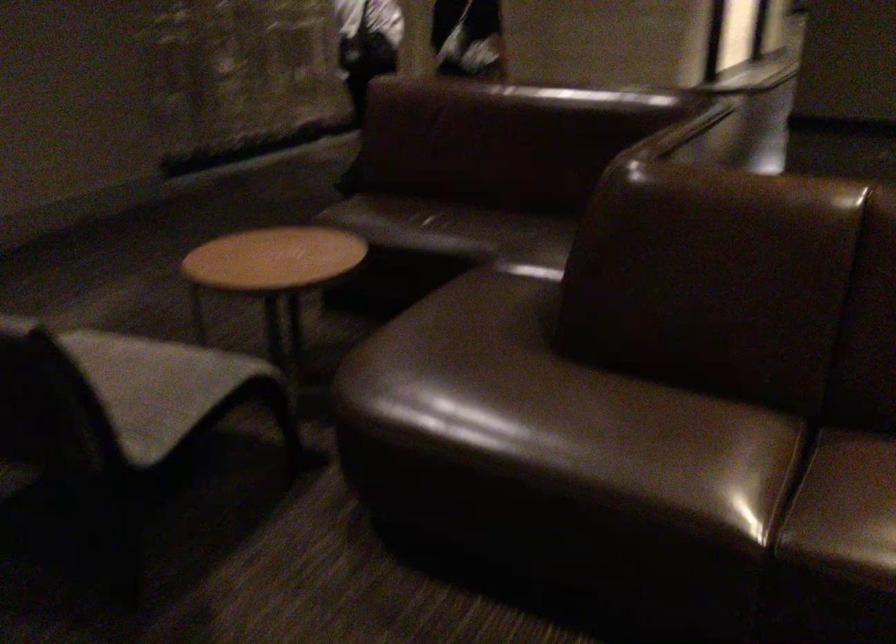
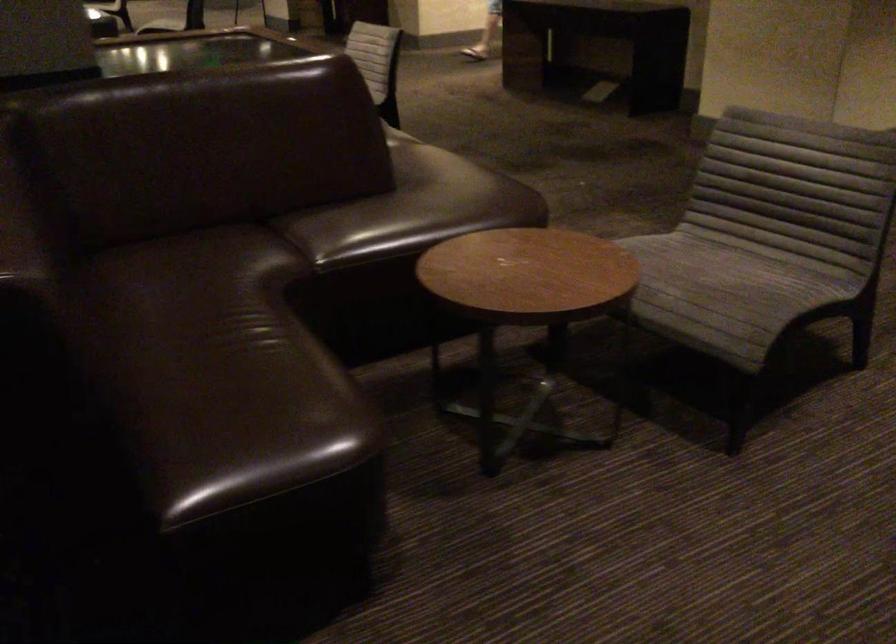
In the second image, find the point that corresponds to [101,351] in the first image.

(722, 286)